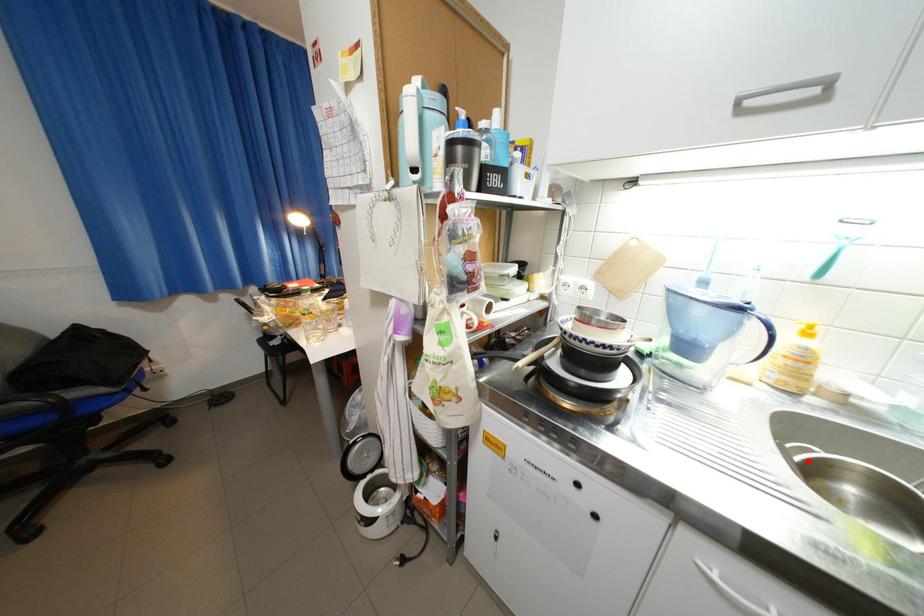
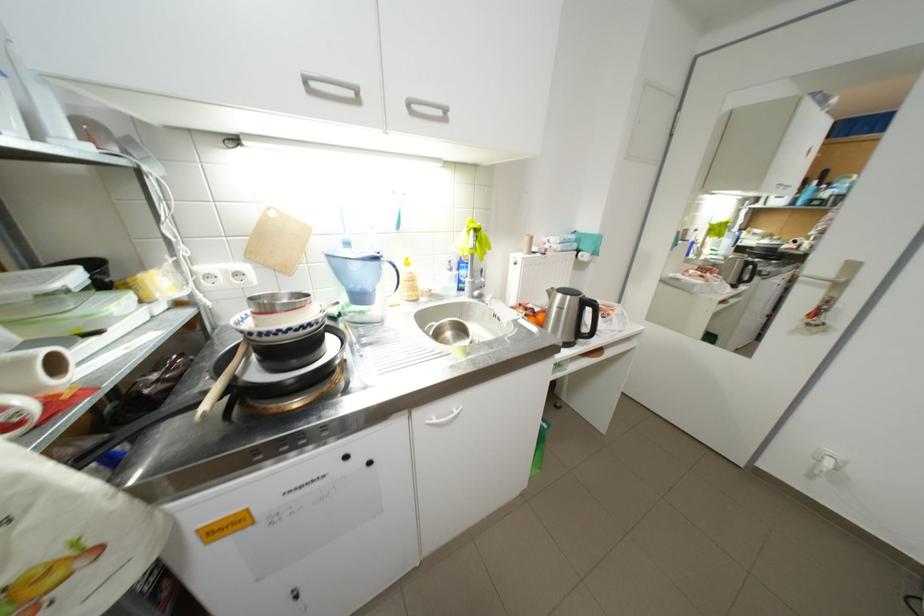
The point at the highlighted location is marked in the first image. Where is the corresponding point in the second image?

(443, 334)